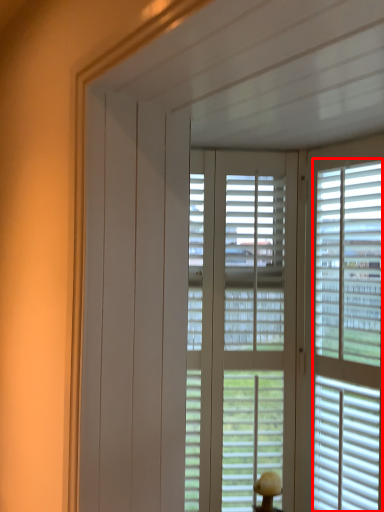
Question: From the image's perspective, what is the correct spatial positioning of blind (annotated by the red box) in reference to window blind?

Choices:
 (A) above
 (B) below

Answer: (A)